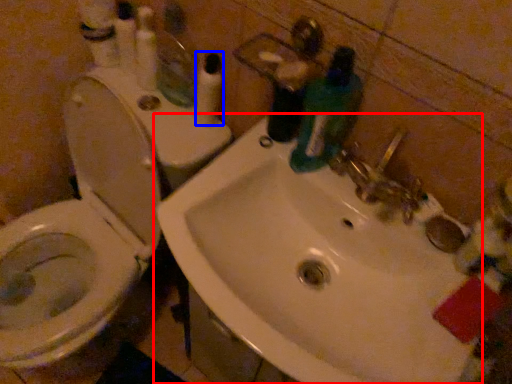
Question: Which object is further to the camera taking this photo, sink (highlighted by a red box) or toiletry (highlighted by a blue box)?

Choices:
 (A) sink
 (B) toiletry

Answer: (B)